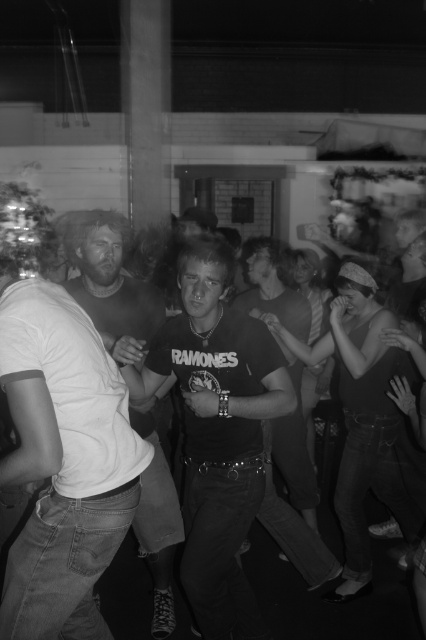
Question: Does matte white shirt at center appear under dark gray t-shirt at center?

Choices:
 (A) yes
 (B) no

Answer: (A)

Question: Considering the relative positions of matte white shirt at center and dark gray t-shirt at center in the image provided, where is matte white shirt at center located with respect to dark gray t-shirt at center?

Choices:
 (A) below
 (B) above

Answer: (A)

Question: Which point appears closest to the camera in this image?

Choices:
 (A) (271, 342)
 (B) (308, 465)

Answer: (A)

Question: Among these objects, which one is farthest from the camera?

Choices:
 (A) dark gray t-shirt at center
 (B) matte white shirt at center

Answer: (A)

Question: Which point is closer to the camera taking this photo?

Choices:
 (A) (65, 240)
 (B) (287, 435)

Answer: (A)

Question: Is matte black t-shirt at center closer to the viewer compared to dark gray t-shirt at center?

Choices:
 (A) yes
 (B) no

Answer: (A)